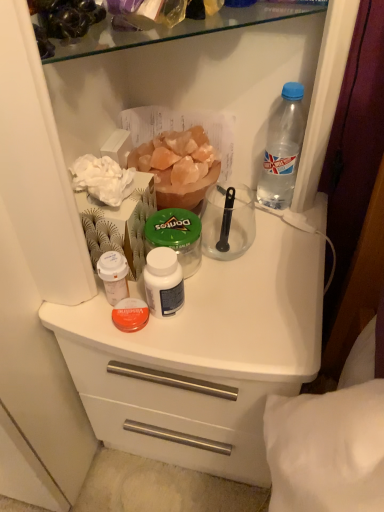
Find the location of a particular element. The height and width of the screenshot is (512, 384). free spot in front of orange crystal salt at center is located at coordinates (210, 302).